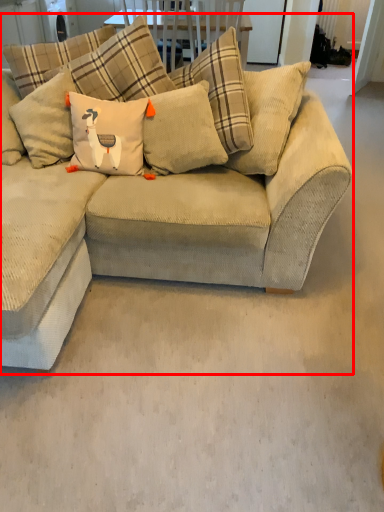
Question: From the image's perspective, considering the relative positions of studio couch (annotated by the red box) and pillow in the image provided, where is studio couch (annotated by the red box) located with respect to the staircase?

Choices:
 (A) below
 (B) above

Answer: (A)